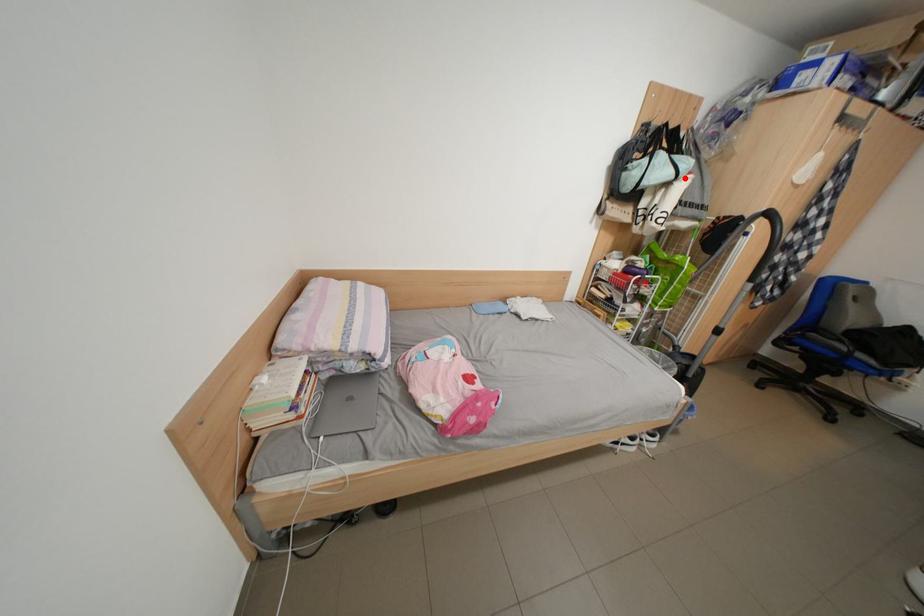
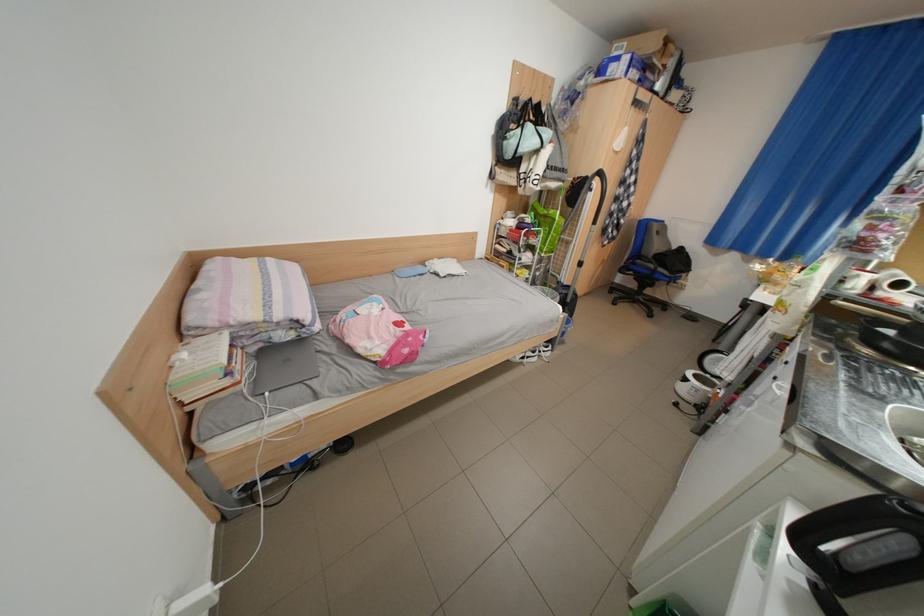
Where in the second image is the point corresponding to the highlighted location from the first image?

(552, 147)